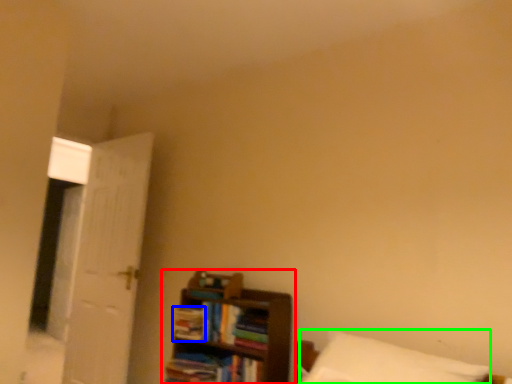
Question: Which object is positioned closest to shelf (highlighted by a red box)? Select from book (highlighted by a blue box) and pillow (highlighted by a green box).

Choices:
 (A) book
 (B) pillow

Answer: (A)